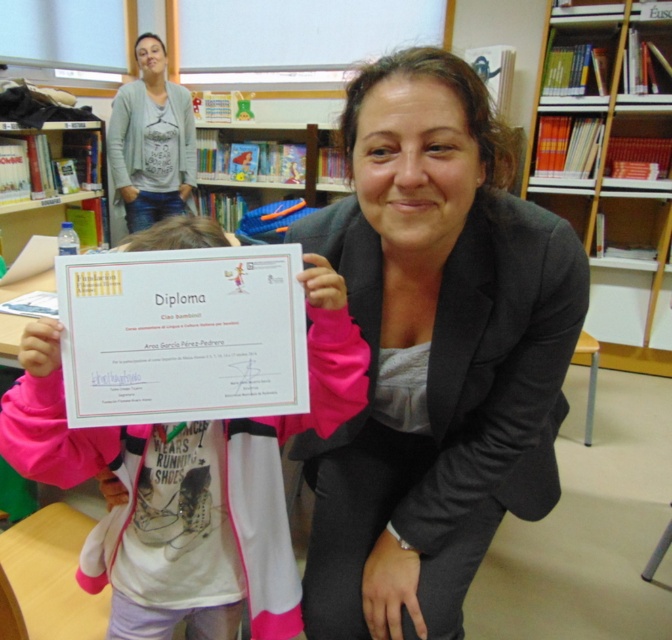
Question: Based on their relative distances, which object is nearer to the gray cardigan at upper left?

Choices:
 (A) wooden bookshelf at upper right
 (B) pink fabric at center
 (C) matte black blazer at center

Answer: (A)

Question: Which of the following is the closest to the observer?

Choices:
 (A) (132, 173)
 (B) (190, 448)
 (C) (546, 60)

Answer: (B)

Question: Considering the relative positions of matte black blazer at center and wooden bookshelf at upper right in the image provided, where is matte black blazer at center located with respect to wooden bookshelf at upper right?

Choices:
 (A) left
 (B) right

Answer: (A)

Question: Is matte black blazer at center thinner than gray cardigan at upper left?

Choices:
 (A) yes
 (B) no

Answer: (B)

Question: Which of the following is the closest to the observer?

Choices:
 (A) wooden bookshelf at upper right
 (B) gray cardigan at upper left
 (C) pink fabric at center
 (D) matte black blazer at center

Answer: (D)

Question: In this image, where is matte black blazer at center located relative to gray cardigan at upper left?

Choices:
 (A) left
 (B) right

Answer: (B)